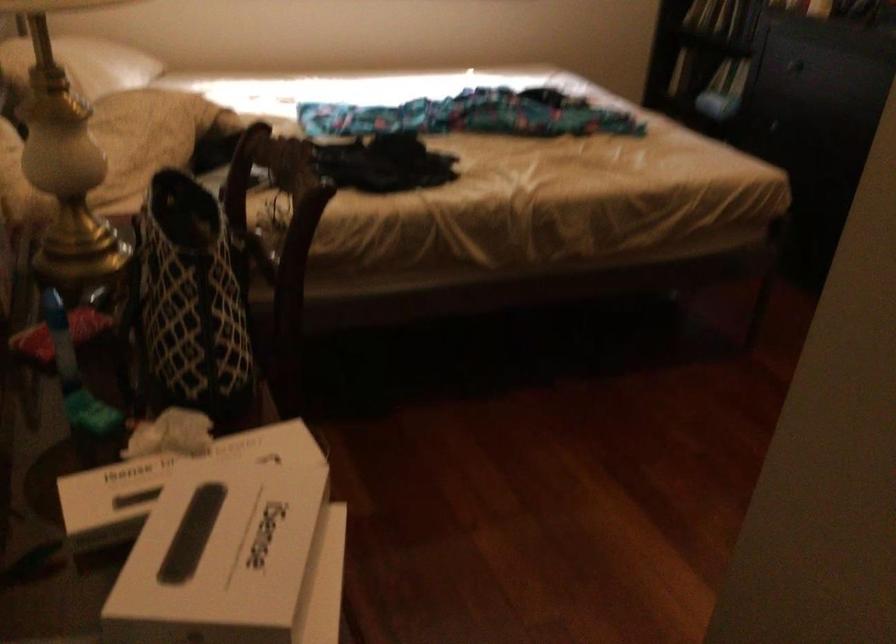
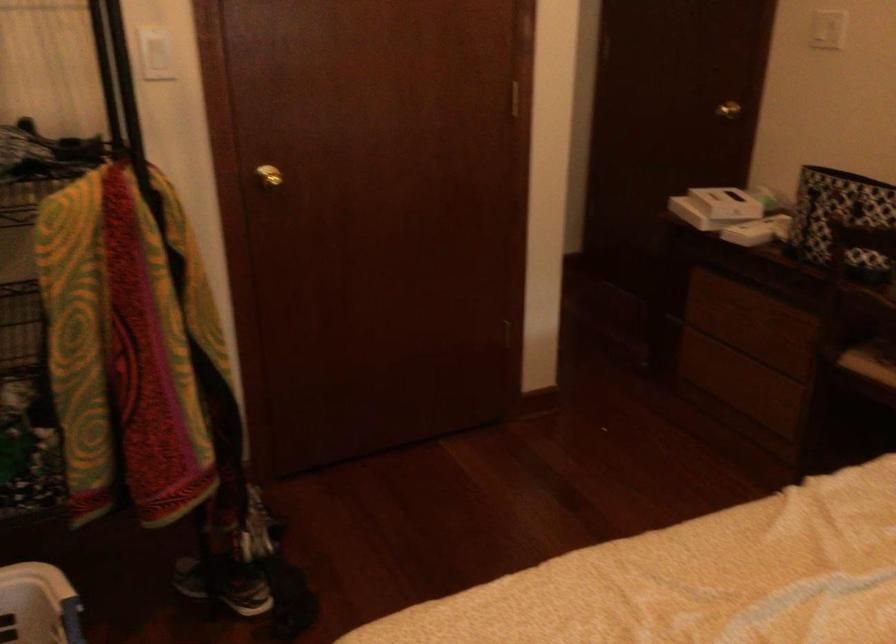
Locate, in the second image, the point that corresponds to (x=306, y=180) in the first image.

(840, 218)